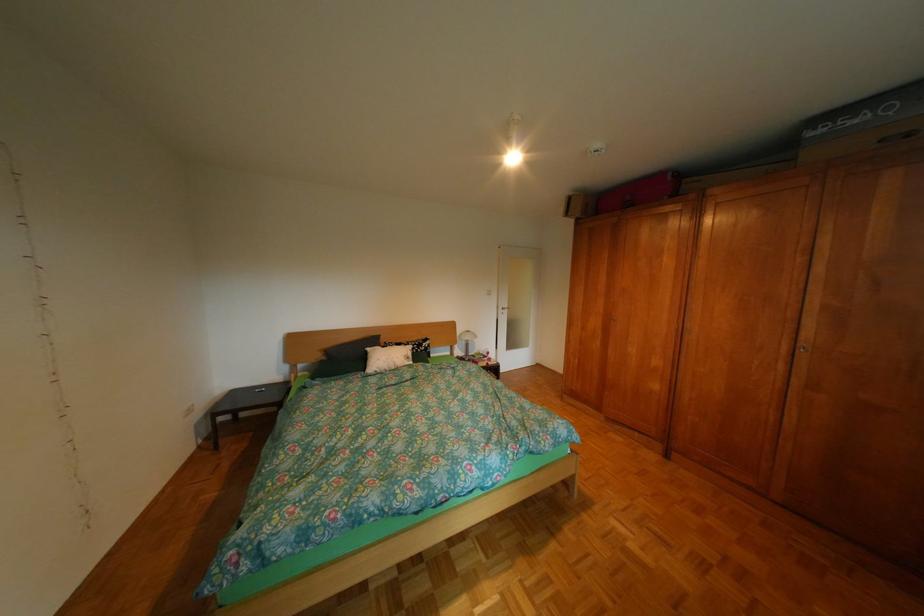
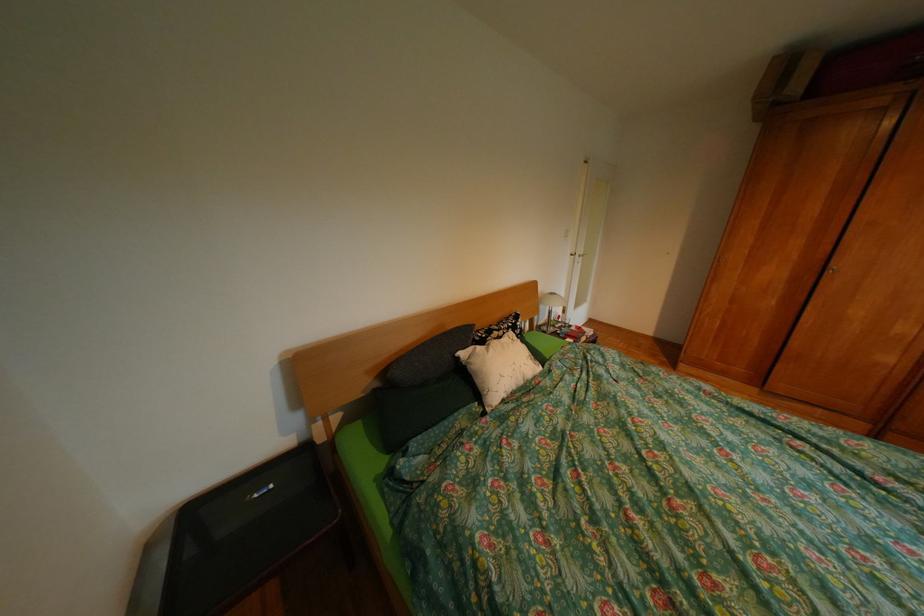
Find the pixel in the second image that matches [338,359] in the first image.

(392, 385)